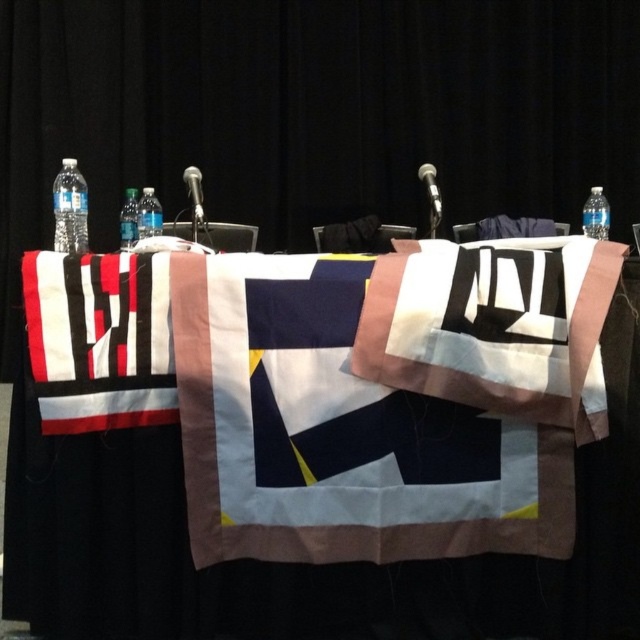
Question: Can you confirm if clear plastic bottle at center is thinner than metallic silver microphone at upper center?

Choices:
 (A) no
 (B) yes

Answer: (A)

Question: Can you confirm if clear plastic bottle at left is thinner than matte black microphone at center?

Choices:
 (A) yes
 (B) no

Answer: (B)

Question: Does clear plastic bottle at right appear on the right side of clear plastic bottle at upper left?

Choices:
 (A) no
 (B) yes

Answer: (B)

Question: Which of these objects is positioned farthest from the clear plastic bottle at left?

Choices:
 (A) metallic silver microphone at upper center
 (B) matte black microphone at center

Answer: (A)

Question: Which point is closer to the camera?

Choices:
 (A) (604, 237)
 (B) (428, 202)
 (C) (360, 300)
 (D) (192, 186)

Answer: (C)

Question: Based on their relative distances, which object is nearer to the clear plastic bottle at center?

Choices:
 (A) clear plastic bottle at right
 (B) clear plastic bottle at upper left

Answer: (B)